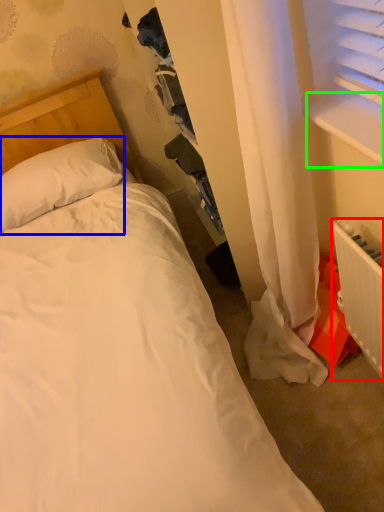
Question: Estimate the real-world distances between objects in this image. Which object is farther from radiator (highlighted by a red box), pillow (highlighted by a blue box) or window sill (highlighted by a green box)?

Choices:
 (A) pillow
 (B) window sill

Answer: (A)